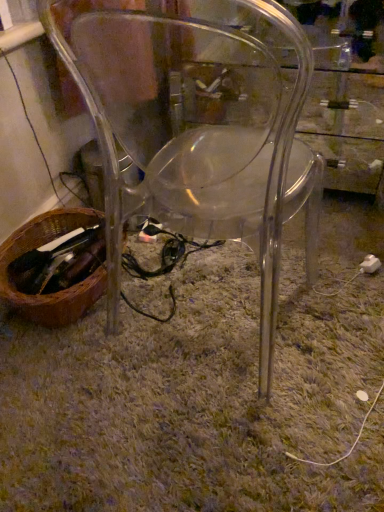
Question: From the image's perspective, is white plastic plug at lower right on top of green shaggy carpet at center?

Choices:
 (A) yes
 (B) no

Answer: (B)

Question: Does white plastic plug at lower right appear on the left side of green shaggy carpet at center?

Choices:
 (A) yes
 (B) no

Answer: (B)

Question: Does white plastic plug at lower right contain green shaggy carpet at center?

Choices:
 (A) yes
 (B) no

Answer: (B)

Question: Considering the relative positions of white plastic plug at lower right and green shaggy carpet at center in the image provided, is white plastic plug at lower right behind green shaggy carpet at center?

Choices:
 (A) no
 (B) yes

Answer: (B)

Question: Is white plastic plug at lower right wider than green shaggy carpet at center?

Choices:
 (A) yes
 (B) no

Answer: (B)

Question: In the image, is transparent plastic chair at center positioned in front of or behind brown woven basket at lower left?

Choices:
 (A) front
 (B) behind

Answer: (A)

Question: From a real-world perspective, is transparent plastic chair at center positioned above or below brown woven basket at lower left?

Choices:
 (A) below
 (B) above

Answer: (B)

Question: Considering the positions of transparent plastic chair at center and brown woven basket at lower left in the image, is transparent plastic chair at center wider or thinner than brown woven basket at lower left?

Choices:
 (A) wide
 (B) thin

Answer: (A)

Question: Do you think transparent plastic chair at center is within brown woven basket at lower left, or outside of it?

Choices:
 (A) inside
 (B) outside

Answer: (B)

Question: Based on their sizes in the image, would you say white plastic plug at lower right is bigger or smaller than brown woven basket at lower left?

Choices:
 (A) small
 (B) big

Answer: (A)

Question: Is white plastic plug at lower right inside the boundaries of brown woven basket at lower left, or outside?

Choices:
 (A) outside
 (B) inside

Answer: (A)

Question: From their relative heights in the image, would you say white plastic plug at lower right is taller or shorter than brown woven basket at lower left?

Choices:
 (A) short
 (B) tall

Answer: (A)

Question: From the image's perspective, is white plastic plug at lower right positioned above or below brown woven basket at lower left?

Choices:
 (A) above
 (B) below

Answer: (B)

Question: Does point (6, 298) appear closer or farther from the camera than point (367, 260)?

Choices:
 (A) closer
 (B) farther

Answer: (A)

Question: From the image's perspective, relative to white plastic plug at lower right, is brown woven basket at lower left above or below?

Choices:
 (A) below
 (B) above

Answer: (B)